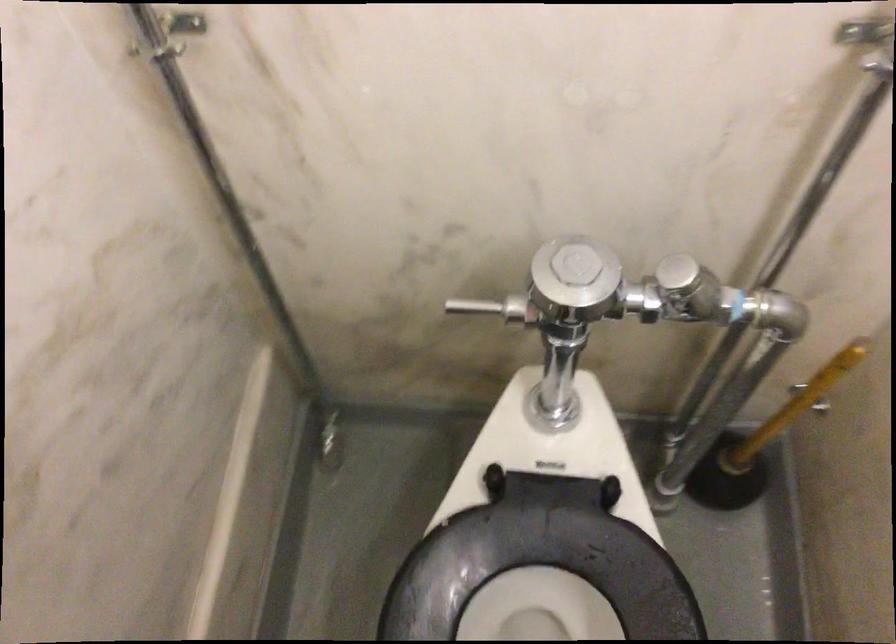
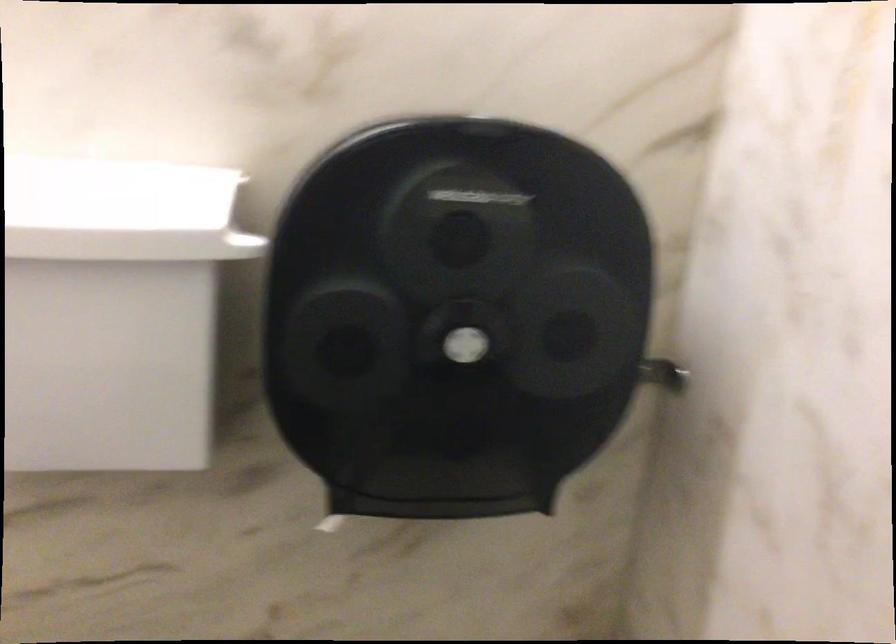
The first image is from the beginning of the video and the second image is from the end. How did the camera likely rotate when shooting the video?

The camera rotated toward right-down.